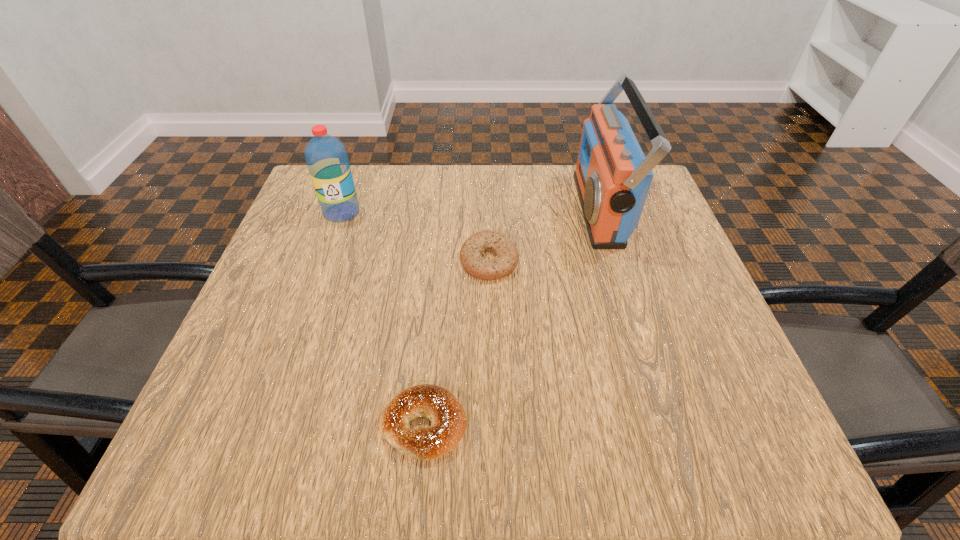
At what (x,y) coordinates should I click in order to perform the action: click on free space located 0.200m on the front of the farther bagel. Please return your answer as a coordinate pair (x, y). This screenshot has height=540, width=960. Looking at the image, I should click on (491, 366).

At what (x,y) coordinates should I click in order to perform the action: click on vacant space located on the right of the nearest object. Please return your answer as a coordinate pair (x, y). Looking at the image, I should click on (581, 424).

You are a GUI agent. You are given a task and a screenshot of the screen. Output one action in this format:
    pyautogui.click(x=<x>, y=<y>)
    Task: Click on the radio receiver that is at the far edge
    The image size is (960, 540).
    Given the screenshot: What is the action you would take?
    pyautogui.click(x=612, y=176)

Find the location of a particular element. water bottle that is at the far edge is located at coordinates (326, 157).

Where is `object that is at the near edge`? object that is at the near edge is located at coordinates (434, 403).

You are a GUI agent. You are given a task and a screenshot of the screen. Output one action in this format:
    pyautogui.click(x=<x>, y=<y>)
    Task: Click on the object positioned at the left edge
    The width and height of the screenshot is (960, 540).
    Given the screenshot: What is the action you would take?
    pyautogui.click(x=326, y=157)

Locate an element on the screen. object that is at the right edge is located at coordinates (612, 176).

Image resolution: width=960 pixels, height=540 pixels. Find the location of `object that is at the far left corner`. object that is at the far left corner is located at coordinates (326, 157).

At what (x,y) coordinates should I click in order to perform the action: click on object at the far right corner. Please return your answer as a coordinate pair (x, y). Image resolution: width=960 pixels, height=540 pixels. Looking at the image, I should click on (612, 176).

Locate an element on the screen. The image size is (960, 540). free spot at the far edge of the desktop is located at coordinates (507, 215).